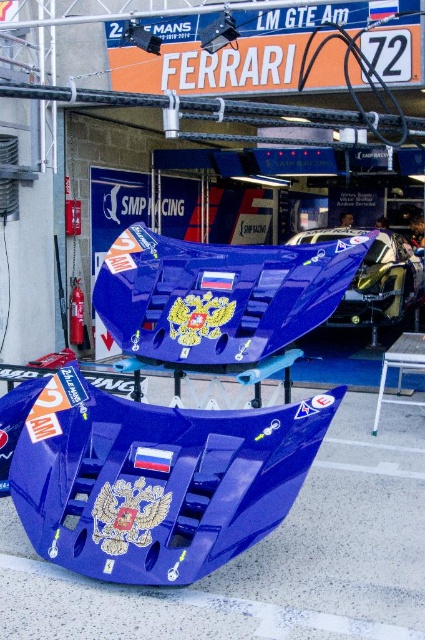
Question: From the image, what is the correct spatial relationship of glossy blue spoiler at center in relation to glossy blue car at center?

Choices:
 (A) left
 (B) right

Answer: (A)

Question: Does glossy blue spoiler at center appear on the right side of glossy blue car at center?

Choices:
 (A) yes
 (B) no

Answer: (B)

Question: Which point is farther to the camera?

Choices:
 (A) (402, 280)
 (B) (289, 451)

Answer: (A)

Question: Can you confirm if glossy blue spoiler at center is wider than glossy blue car at center?

Choices:
 (A) no
 (B) yes

Answer: (B)

Question: Which of the following is the closest to the observer?

Choices:
 (A) (342, 316)
 (B) (96, 492)

Answer: (B)